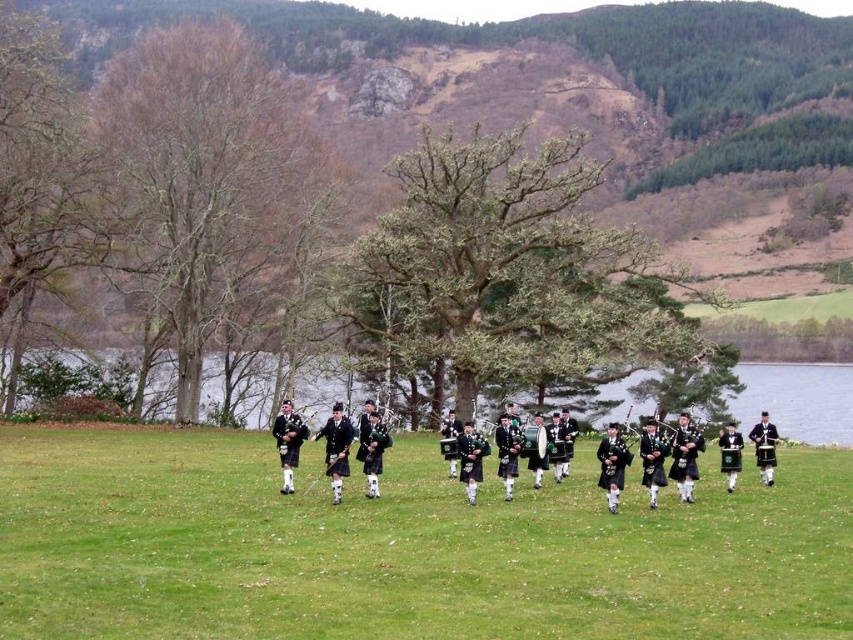
You are a photographer planning to capture a closeup of the green grass at center and the green leafy tree at center in the scene. Based on their sizes, which one would you need to get closer to in order to fill the frame?

The green grass at center occupies less space than the green leafy tree at center, so you would need to get closer to the green grass at center to fill the frame.

You are a photographer trying to capture the pipers and the background. Which object, the green leafy tree at center or the bare wood at left, would be closer to the camera when focusing on the pipers?

The green leafy tree at center is closer to the camera than the bare wood at left because it is positioned in front of it.